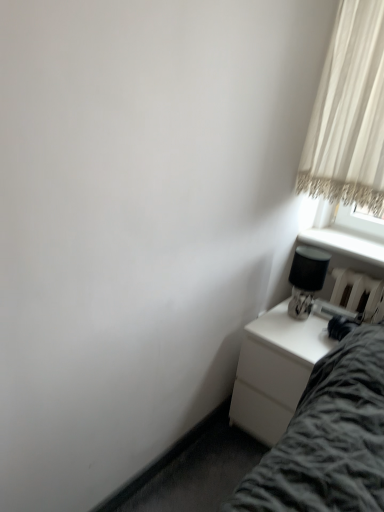
The width and height of the screenshot is (384, 512). Identify the location of black glossy table lamp at right. (306, 279).

This screenshot has height=512, width=384. I want to click on white sheer curtain at upper right, so click(349, 113).

Is white sheer curtain at upper right taller or shorter than white glossy nightstand at lower right?

Considering their sizes, white sheer curtain at upper right has more height than white glossy nightstand at lower right.

From a real-world perspective, is white sheer curtain at upper right physically above white glossy nightstand at lower right?

Correct, in the physical world, white sheer curtain at upper right is higher than white glossy nightstand at lower right.

Considering the relative sizes of white sheer curtain at upper right and white glossy nightstand at lower right in the image provided, is white sheer curtain at upper right wider than white glossy nightstand at lower right?

No, white sheer curtain at upper right is not wider than white glossy nightstand at lower right.

Can you confirm if white sheer curtain at upper right is smaller than white glossy nightstand at lower right?

Yes, white sheer curtain at upper right is smaller than white glossy nightstand at lower right.

Is black glossy table lamp at right located outside white sheer curtain at upper right?

Absolutely, black glossy table lamp at right is external to white sheer curtain at upper right.

Is black glossy table lamp at right positioned far away from white sheer curtain at upper right?

No, black glossy table lamp at right is not far from white sheer curtain at upper right.

Which is more to the left, black glossy table lamp at right or white sheer curtain at upper right?

black glossy table lamp at right.

Is white glossy nightstand at lower right beside white sheer curtain at upper right?

No, white glossy nightstand at lower right is not touching white sheer curtain at upper right.

Does white glossy nightstand at lower right appear on the left side of white sheer curtain at upper right?

Correct, you'll find white glossy nightstand at lower right to the left of white sheer curtain at upper right.

The image size is (384, 512). Identify the location of curtain above the white glossy nightstand at lower right (from the image's perspective). (349, 113).

Would you say white glossy nightstand at lower right is inside or outside white sheer curtain at upper right?

white glossy nightstand at lower right lies outside white sheer curtain at upper right.

Which is nearer, [290,307] or [258,334]?

Clearly, point [290,307] is more distant from the camera than point [258,334].

Consider the image. From the image's perspective, is black glossy table lamp at right below white glossy nightstand at lower right?

Actually, black glossy table lamp at right appears above white glossy nightstand at lower right in the image.

Does black glossy table lamp at right appear on the right side of white glossy nightstand at lower right?

Indeed, black glossy table lamp at right is positioned on the right side of white glossy nightstand at lower right.

How many degrees apart are the facing directions of black glossy table lamp at right and white glossy nightstand at lower right?

0.842 degrees.

Based on their sizes in the image, would you say white sheer curtain at upper right is bigger or smaller than black glossy table lamp at right?

Considering their sizes, white sheer curtain at upper right takes up more space than black glossy table lamp at right.

Are white sheer curtain at upper right and black glossy table lamp at right located far from each other?

No, white sheer curtain at upper right is not far away from black glossy table lamp at right.

Locate an element on the screen. curtain on the right of black glossy table lamp at right is located at coordinates (349, 113).

Is white sheer curtain at upper right turned away from black glossy table lamp at right?

No, white sheer curtain at upper right's orientation is not away from black glossy table lamp at right.

Is white glossy nightstand at lower right to the left of black glossy table lamp at right from the viewer's perspective?

Yes.

Which is less distant, (273, 343) or (298, 309)?

Positioned in front is point (273, 343).

Between white glossy nightstand at lower right and black glossy table lamp at right, which one has less height?

black glossy table lamp at right.

Is white glossy nightstand at lower right wider than black glossy table lamp at right?

Indeed, white glossy nightstand at lower right has a greater width compared to black glossy table lamp at right.

The width and height of the screenshot is (384, 512). I want to click on curtain above the white glossy nightstand at lower right (from the image's perspective), so click(349, 113).

At what (x,y) coordinates should I click in order to perform the action: click on table lamp to the left of white sheer curtain at upper right. Please return your answer as a coordinate pair (x, y). This screenshot has height=512, width=384. Looking at the image, I should click on point(306,279).

Considering their positions, is black glossy table lamp at right positioned further to white glossy nightstand at lower right than white sheer curtain at upper right?

Among the two, white sheer curtain at upper right is located further to white glossy nightstand at lower right.

Looking at this image, from the image, which object appears to be farther from white sheer curtain at upper right, white glossy nightstand at lower right or black glossy table lamp at right?

white glossy nightstand at lower right is positioned further to the anchor white sheer curtain at upper right.

Based on their spatial positions, is black glossy table lamp at right or white glossy nightstand at lower right further from white sheer curtain at upper right?

Among the two, white glossy nightstand at lower right is located further to white sheer curtain at upper right.

When comparing their distances from black glossy table lamp at right, does white glossy nightstand at lower right or white sheer curtain at upper right seem further?

white sheer curtain at upper right.

Estimate the real-world distances between objects in this image. Which object is further from black glossy table lamp at right, white sheer curtain at upper right or white glossy nightstand at lower right?

white sheer curtain at upper right lies further to black glossy table lamp at right than the other object.

Considering their positions, is white sheer curtain at upper right positioned further to white glossy nightstand at lower right than black glossy table lamp at right?

white sheer curtain at upper right is positioned further to the anchor white glossy nightstand at lower right.

Where is `table lamp between white sheer curtain at upper right and white glossy nightstand at lower right from top to bottom`? The width and height of the screenshot is (384, 512). table lamp between white sheer curtain at upper right and white glossy nightstand at lower right from top to bottom is located at coordinates (306, 279).